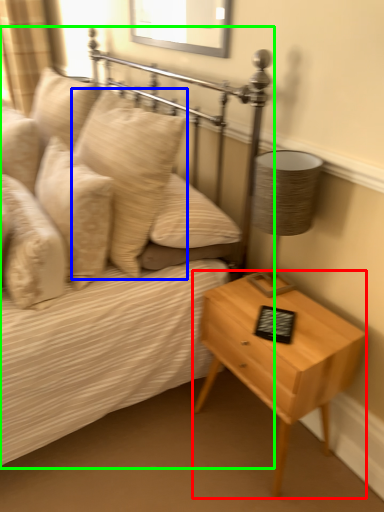
Question: Which object is positioned closest to nightstand (highlighted by a red box)? Select from pillow (highlighted by a blue box) and bed (highlighted by a green box).

Choices:
 (A) pillow
 (B) bed

Answer: (B)